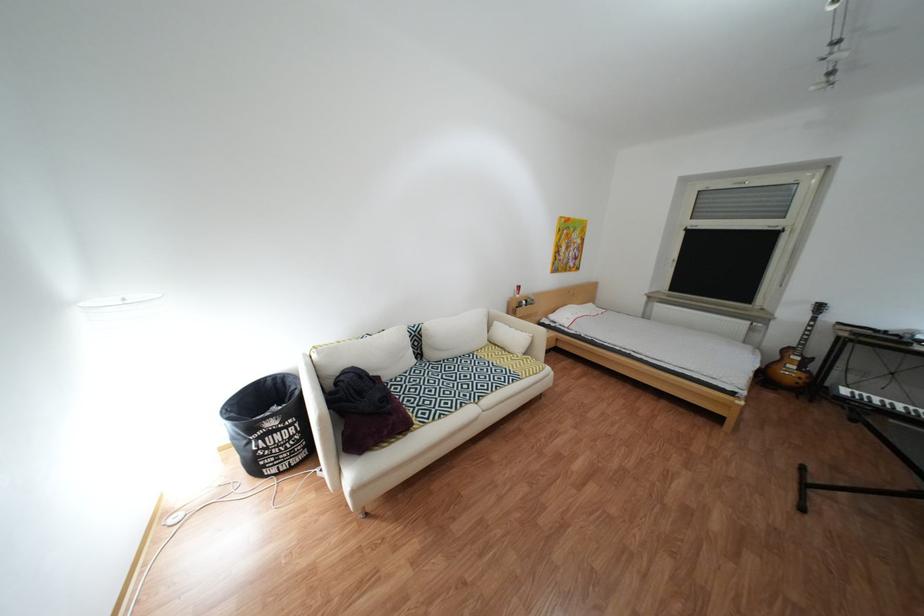
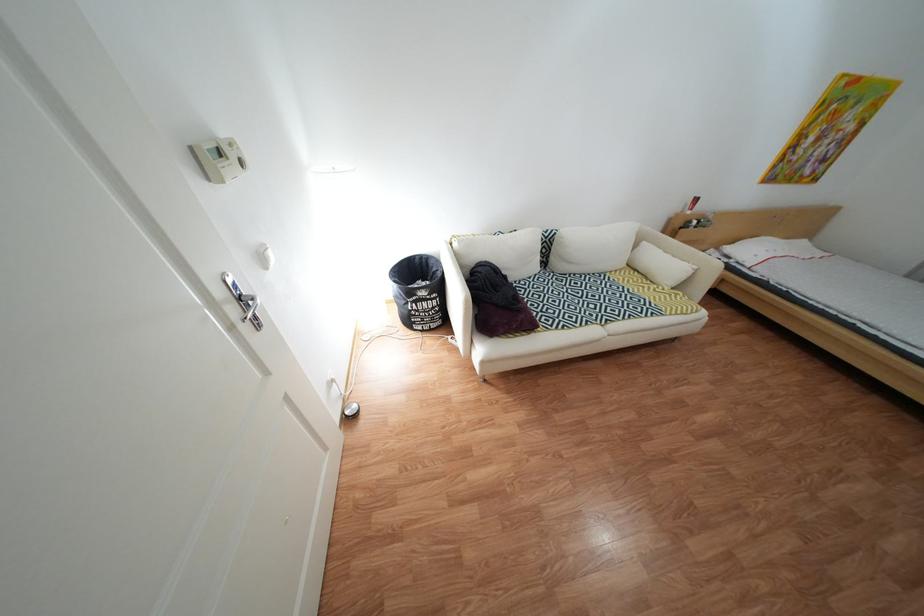
Where in the second image is the point corresponding to point 399,381 from the first image?

(525, 281)